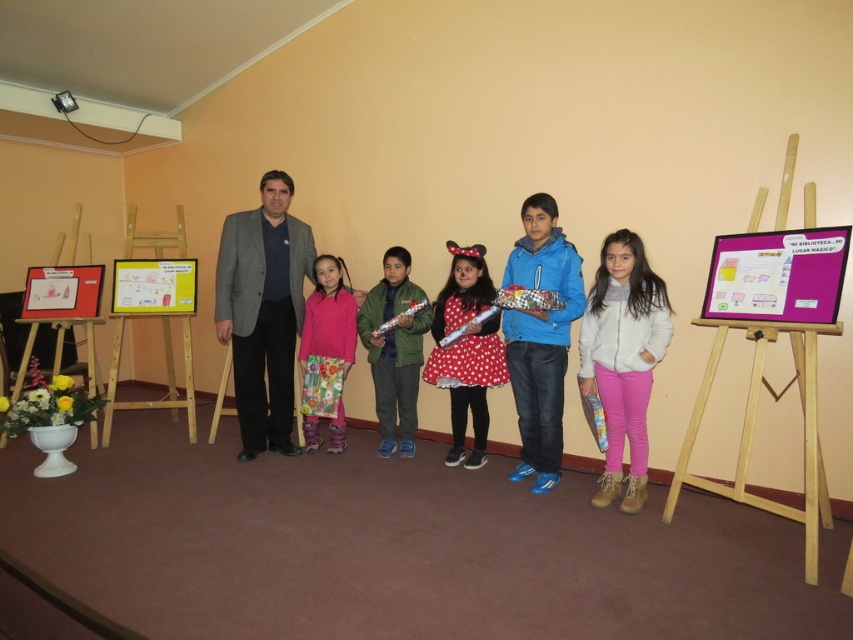
You are organizing a coat rack for the group in the image. The rack has two hooks spaced 1 meter apart. If you hang the green matte jacket at center and the fluffy pink sweater at center on adjacent hooks, will there be enough space between them to accommodate both items comfortably?

The green matte jacket at center is wider than the fluffy pink sweater at center. Since the hooks are spaced 1 meter apart, there should be sufficient space to hang both items comfortably without overcrowding.

You are organizing a group photo and need to position the gray woolen suit at center and the blue matte jacket at center correctly. According to the scene, which one should be placed to the left?

The gray woolen suit at center should be placed to the left of the blue matte jacket at center because the gray woolen suit at center is to the left of blue matte jacket at center in the scene.

You are organizing a clothing donation drive and need to categorize items by size. You see the white suede jacket at center and the red polka dot dress at center in the image. Which item should you place in the small size bin?

The white suede jacket at center should be placed in the small size bin because it has a smaller size compared to the red polka dot dress at center.